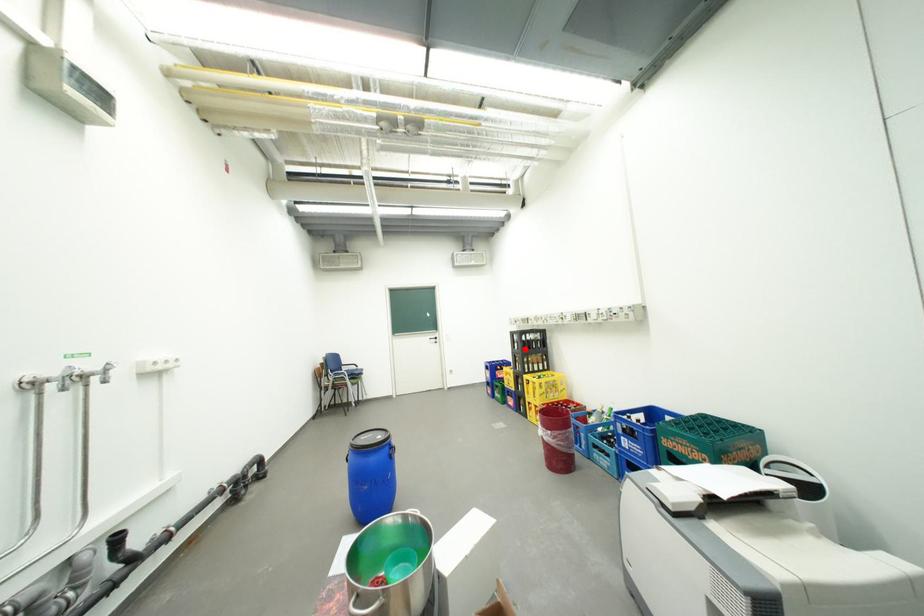
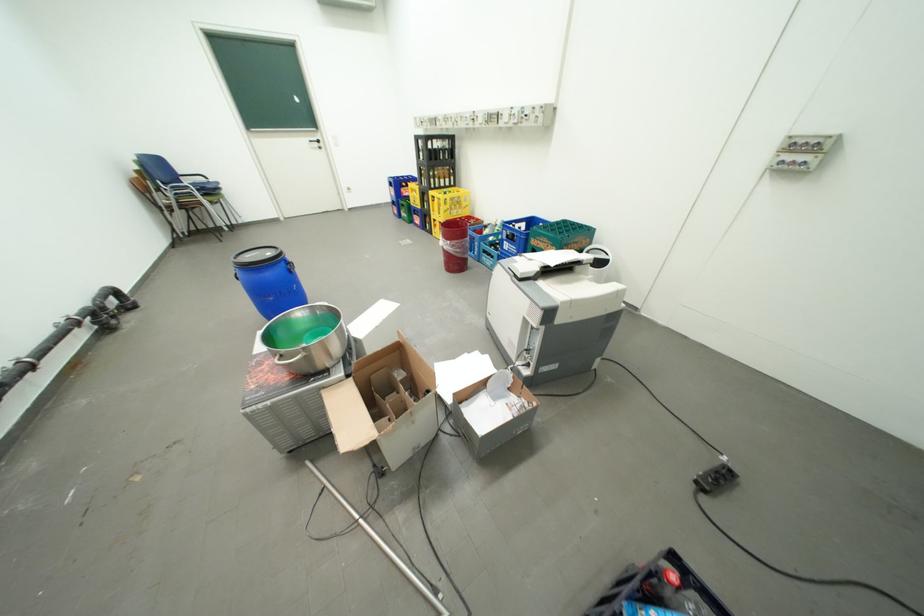
The point at the highlighted location is marked in the first image. Where is the corresponding point in the second image?

(430, 159)